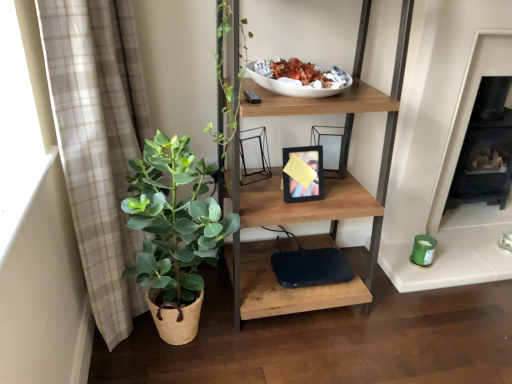
At what (x,y) coordinates should I click in order to perform the action: click on free point below green leafy plant in woven basket at left (from a real-world perspective). Please return your answer as a coordinate pair (x, y). The image size is (512, 384). Looking at the image, I should click on (192, 346).